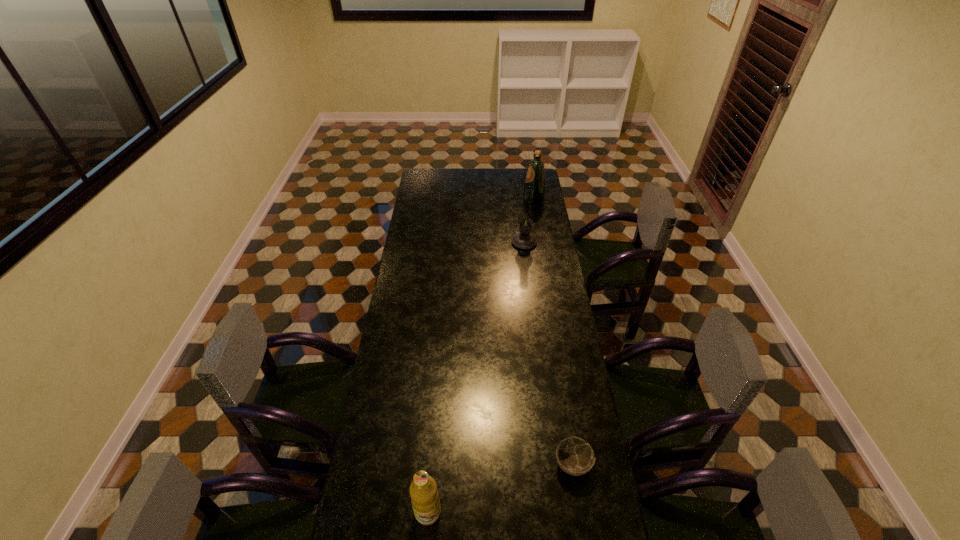
Where is `vacant space located on the front-facing side of the farthest object`? vacant space located on the front-facing side of the farthest object is located at coordinates (484, 198).

Identify the location of vacant space situated on the back of the bowl. (555, 350).

The image size is (960, 540). I want to click on oil lamp located in the right edge section of the desktop, so click(x=524, y=240).

What are the coordinates of `olive oil that is positioned at the right edge` in the screenshot? It's located at (535, 178).

This screenshot has height=540, width=960. Identify the location of bowl at the right edge. (574, 456).

In the image, there is a desktop. Identify the location of free space at the left edge. (406, 381).

At what (x,y) coordinates should I click in order to perform the action: click on vacant region at the right edge. Please return your answer as a coordinate pair (x, y). The width and height of the screenshot is (960, 540). Looking at the image, I should click on (575, 511).

Identify the location of free space at the far left corner of the desktop. Image resolution: width=960 pixels, height=540 pixels. (437, 178).

Identify the location of unoccupied area between the shorter olive oil and the oil lamp. The width and height of the screenshot is (960, 540). (476, 377).

I want to click on free space that is in between the shortest object and the third nearest object, so click(x=548, y=353).